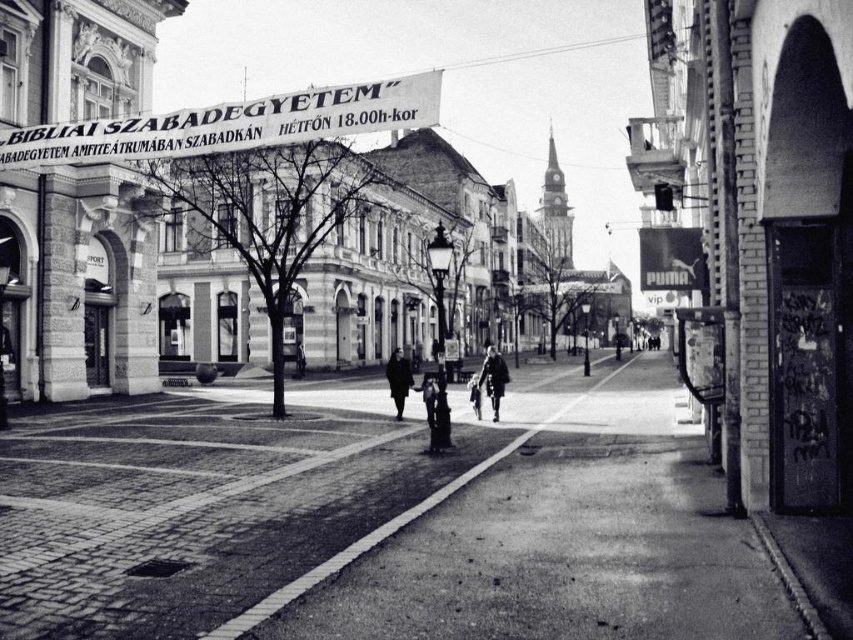
Which of these two, dark gray coat at center or smooth black jacket at center, stands shorter?

With less height is smooth black jacket at center.

Describe the element at coordinates (492, 378) in the screenshot. The width and height of the screenshot is (853, 640). I see `dark gray coat at center` at that location.

Who is more distant from viewer, (486, 387) or (299, 362)?

The point (299, 362) is behind.

Identify the location of dark gray coat at center. (492, 378).

Is shiny chrome motorcycle at center above smooth black jacket at center?

Incorrect, shiny chrome motorcycle at center is not positioned above smooth black jacket at center.

Does shiny chrome motorcycle at center have a greater height compared to smooth black jacket at center?

Yes, shiny chrome motorcycle at center is taller than smooth black jacket at center.

Where is `shiny chrome motorcycle at center`? The image size is (853, 640). shiny chrome motorcycle at center is located at coordinates (474, 394).

Who is positioned more to the right, dark wool coat at center or shiny chrome motorcycle at center?

Positioned to the right is shiny chrome motorcycle at center.

Looking at this image, does dark wool coat at center have a greater width compared to shiny chrome motorcycle at center?

Indeed, dark wool coat at center has a greater width compared to shiny chrome motorcycle at center.

The image size is (853, 640). What do you see at coordinates (398, 380) in the screenshot?
I see `dark wool coat at center` at bounding box center [398, 380].

Locate an element on the screen. dark wool coat at center is located at coordinates (398, 380).